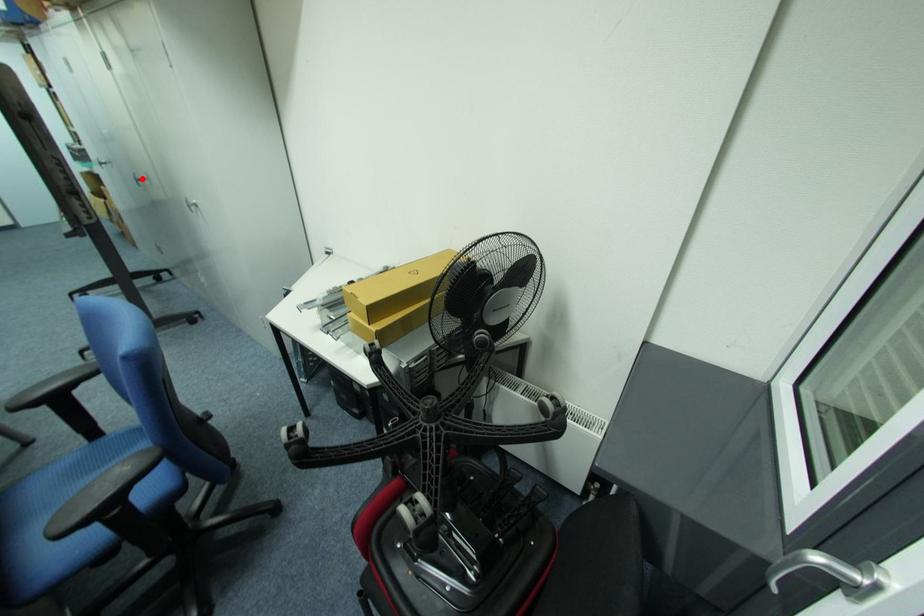
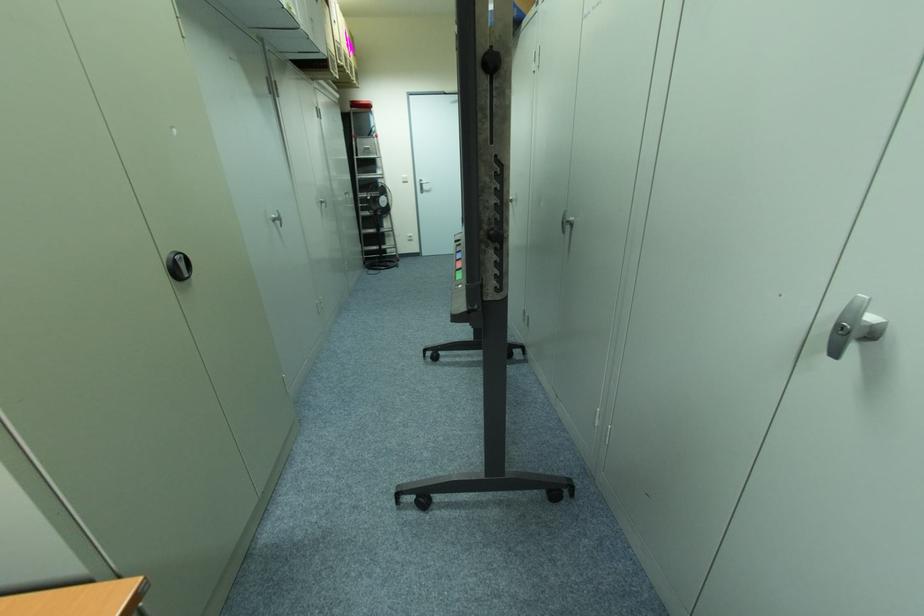
Where in the second image is the point corresponding to the highlighted location from the first image?

(572, 219)